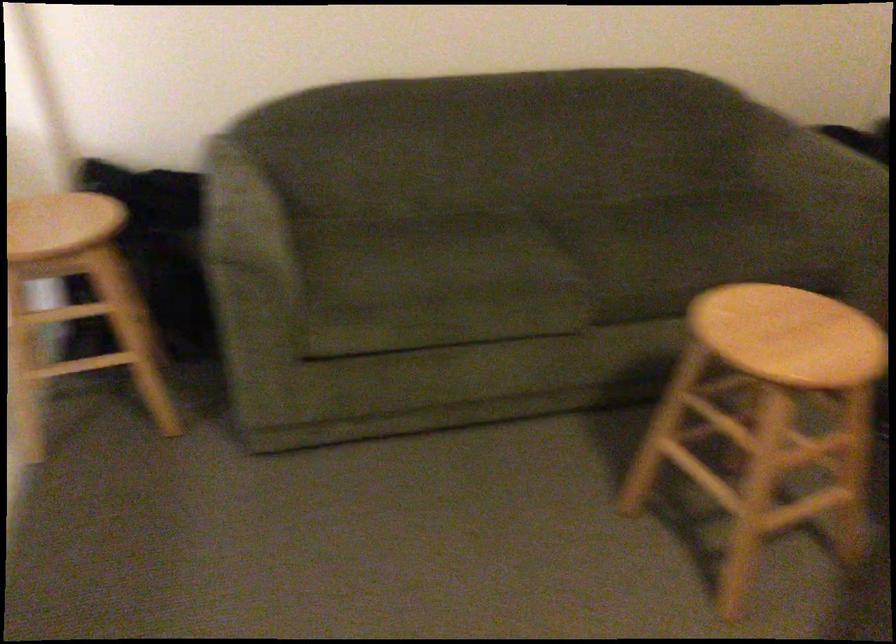
Find where to resting arm the sofa armrest. Please return your answer as a coordinate pair (x, y).

(236, 210)